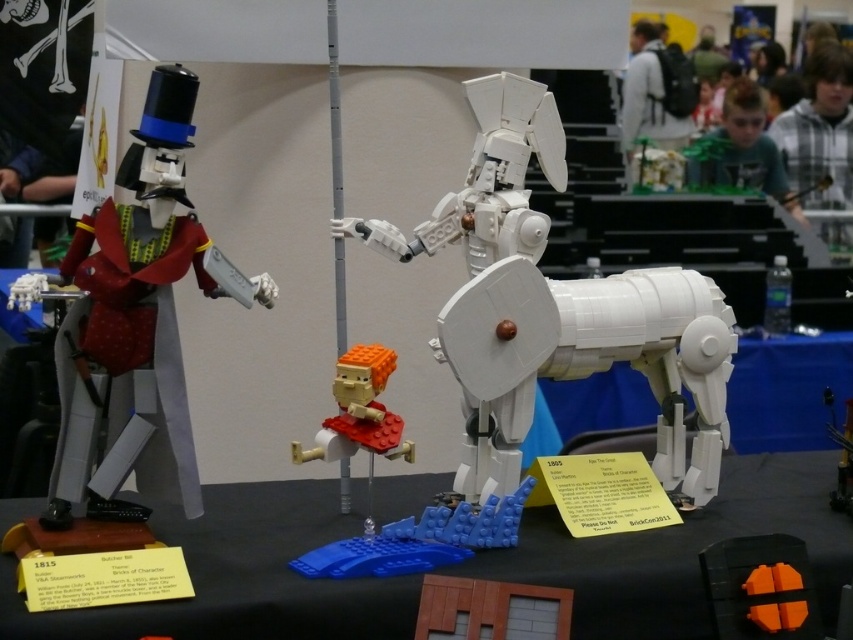
Question: Is matte black figure at left smaller than translucent orange plastic figure at center?

Choices:
 (A) no
 (B) yes

Answer: (A)

Question: Which object appears closest to the camera in this image?

Choices:
 (A) translucent orange plastic figure at center
 (B) matte black figure at left

Answer: (B)

Question: Can you confirm if black plastic table at center is positioned above matte black figure at left?

Choices:
 (A) yes
 (B) no

Answer: (B)

Question: Does white matte robot at center have a smaller size compared to translucent orange plastic figure at center?

Choices:
 (A) yes
 (B) no

Answer: (B)

Question: Which point is closer to the camera?

Choices:
 (A) matte black figure at left
 (B) white matte robot at center
 (C) black plastic table at center
 (D) translucent orange plastic figure at center

Answer: (C)

Question: Among these points, which one is farthest from the camera?

Choices:
 (A) (786, 452)
 (B) (344, 426)
 (C) (463, 304)

Answer: (A)